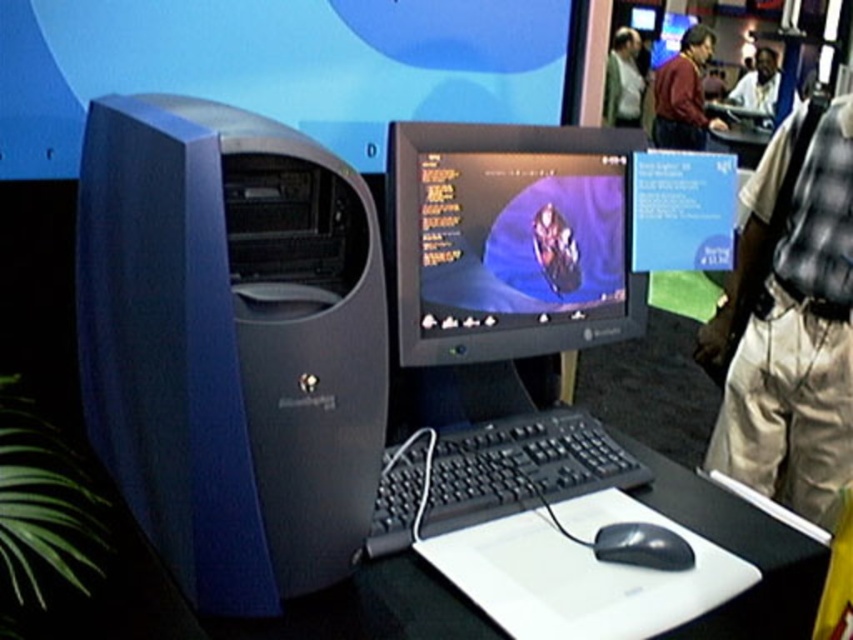
You are a photographer at the exhibition and need to position yourself to capture both the blue plastic desktop computer at left and the light gray shirt at upper center in the same frame. Based on their positions, where should you stand relative to these objects?

You should stand to the right of the blue plastic desktop computer at left so that both it and the light gray shirt at upper center are visible in your frame.

You are standing at the point marked by the coordinates point (802,237). If you want to see the entire monitor, which direction should you move? The monitor is placed in front of the tower. Please choose from the options below. A. Move forward B. Move backward C. Move left D. Move right

The point (802,237) is 1.80 meters away from the viewer. To see the entire monitor, which is in front of the tower, you should move forward to get a better view. The correct answer is A. Move forward.